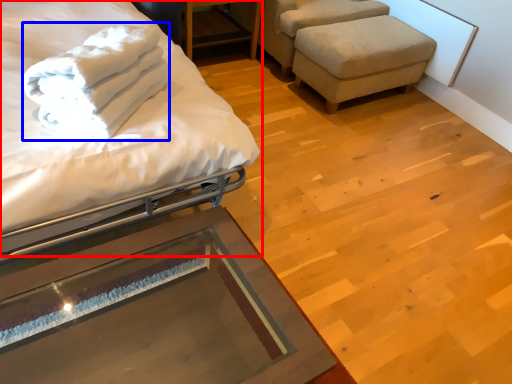
Question: Which object is further to the camera taking this photo, bed (highlighted by a red box) or bath towel (highlighted by a blue box)?

Choices:
 (A) bed
 (B) bath towel

Answer: (B)